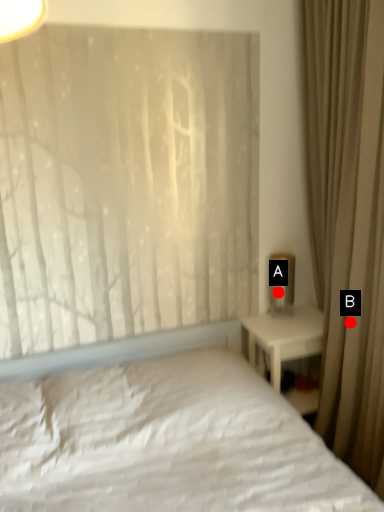
Question: Two points are circled on the image, labeled by A and B beside each circle. Which point appears farthest from the camera in this image?

Choices:
 (A) A is further
 (B) B is further

Answer: (A)